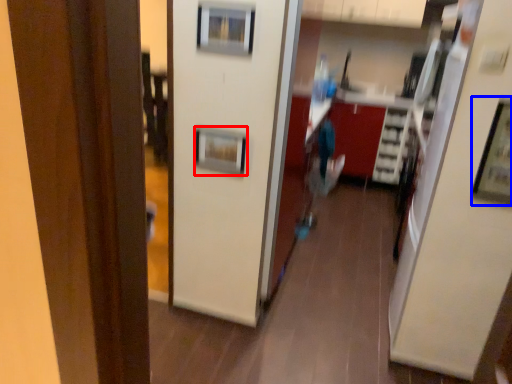
Question: Which point is further to the camera, picture frame (highlighted by a red box) or picture frame (highlighted by a blue box)?

Choices:
 (A) picture frame
 (B) picture frame

Answer: (A)